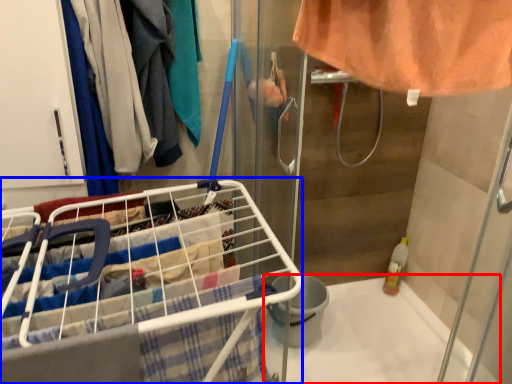
Question: Which object is closer to the camera taking this photo, bath (highlighted by a red box) or shopping cart (highlighted by a blue box)?

Choices:
 (A) bath
 (B) shopping cart

Answer: (B)